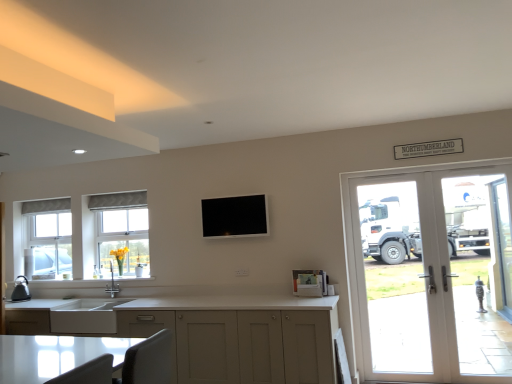
Question: Does point (501, 314) appear closer or farther from the camera than point (98, 327)?

Choices:
 (A) farther
 (B) closer

Answer: (A)

Question: Is clear glass door at right, which is the first screen door in right-to-left order, bigger or smaller than white matte sink at lower left?

Choices:
 (A) big
 (B) small

Answer: (A)

Question: Which object is positioned closest to the white glass screen door at right, the 1th screen door in the front-to-back sequence?

Choices:
 (A) white textured window at center, which is the second window from left to right
 (B) matte white cabinets at lower center
 (C) white matte sink at lower left
 (D) matte black kettle at left
 (E) white glass door at right

Answer: (E)

Question: Which object is positioned farthest from the clear glass window at left, which is the second window in right-to-left order?

Choices:
 (A) white matte sink at lower left
 (B) white glass screen door at right, the first screen door from the left
 (C) matte black kettle at left
 (D) clear glass door at right, which is the first screen door in right-to-left order
 (E) matte white cabinets at lower center

Answer: (D)